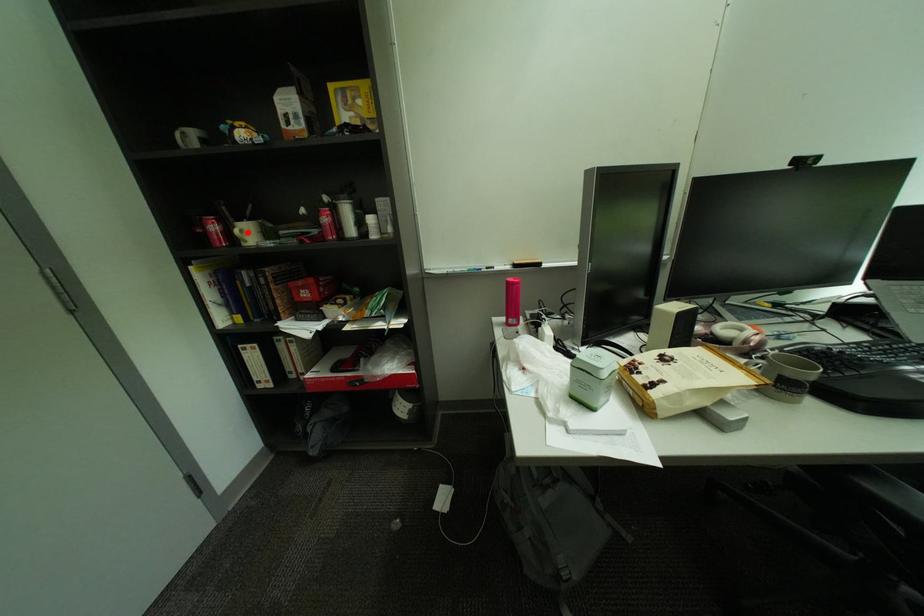
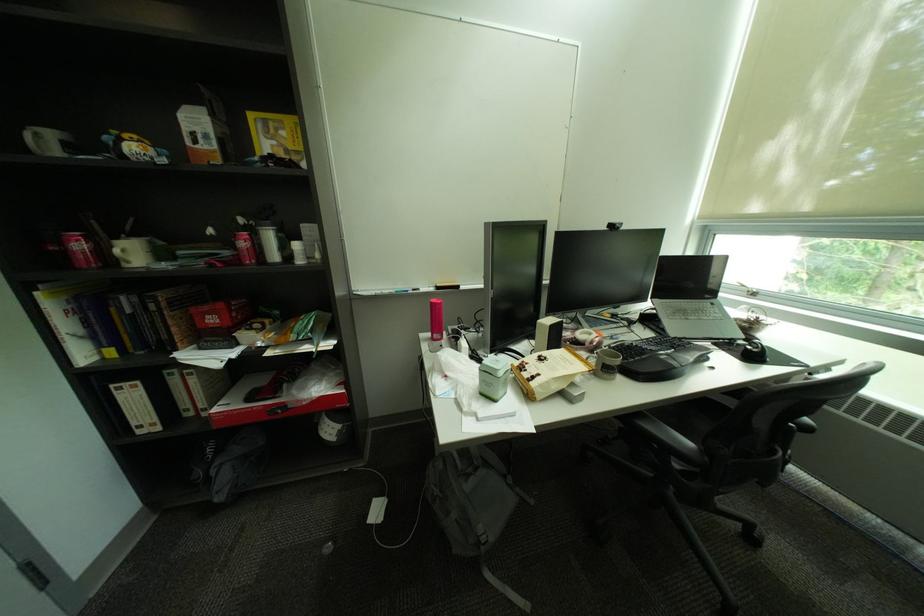
The point at the highlighted location is marked in the first image. Where is the corresponding point in the second image?

(128, 252)